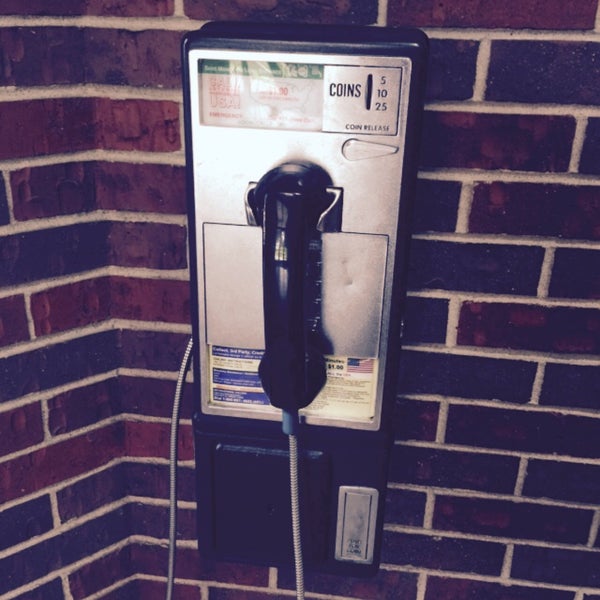
At what (x,y) coordinates should I click in order to perform the action: click on receiver. Please return your answer as a coordinate pair (x, y). Looking at the image, I should click on (293, 186).